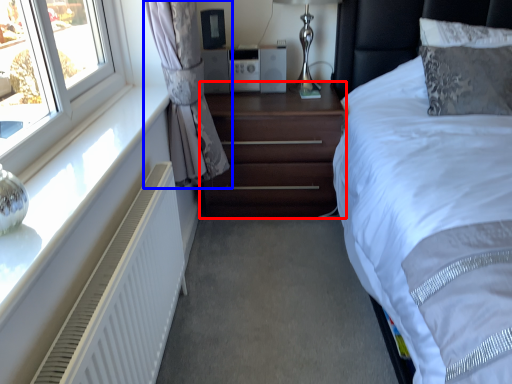
Question: Which object appears farthest to the camera in this image, nightstand (highlighted by a red box) or curtain (highlighted by a blue box)?

Choices:
 (A) nightstand
 (B) curtain

Answer: (A)